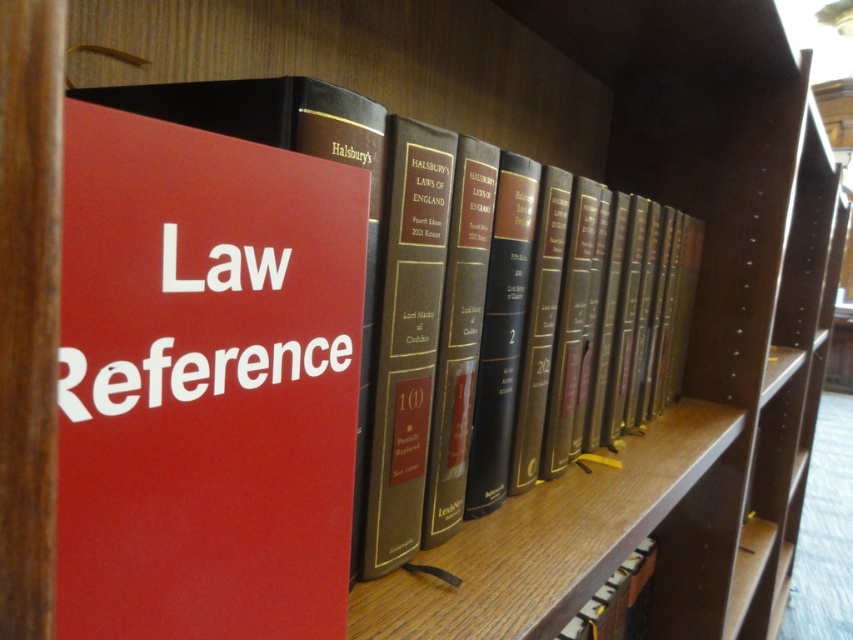
Does matte red book at center have a greater height compared to red matte sign at center?

Yes.

Is matte red book at center above red matte sign at center?

No.

Is point (244, 467) closer to camera compared to point (241, 256)?

No, it is behind (241, 256).

This screenshot has height=640, width=853. In order to click on matte red book at center in this screenshot , I will do `click(204, 384)`.

Which is below, matte red book at center or hardcover book at center?

hardcover book at center is below.

Between matte red book at center and hardcover book at center, which one has more height?

With more height is hardcover book at center.

Between point (312, 372) and point (616, 620), which one is positioned behind?

The point (616, 620) is behind.

Where is `matte red book at center`? The width and height of the screenshot is (853, 640). matte red book at center is located at coordinates (204, 384).

Is red matte sign at center thinner than hardcover book at center?

Yes, red matte sign at center is thinner than hardcover book at center.

You are a GUI agent. You are given a task and a screenshot of the screen. Output one action in this format:
    pyautogui.click(x=<x>, y=<y>)
    Task: Click on the red matte sign at center
    The height and width of the screenshot is (640, 853).
    Given the screenshot: What is the action you would take?
    pyautogui.click(x=190, y=372)